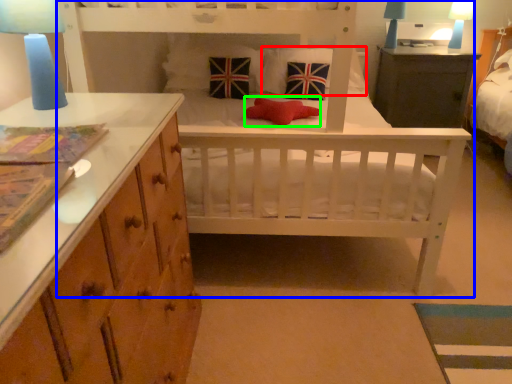
Question: Which is nearer to the pillow (highlighted by a red box)? infant bed (highlighted by a blue box) or pillow (highlighted by a green box).

Choices:
 (A) infant bed
 (B) pillow

Answer: (B)